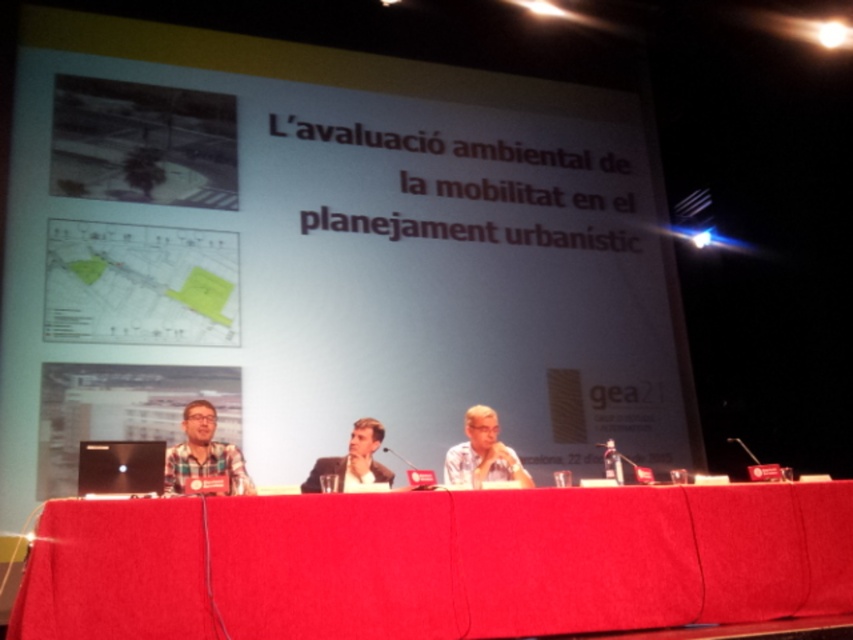
Who is more forward, (836, 570) or (502, 474)?

Point (836, 570) is in front.

Is red fabric table at center positioned at the back of matte black glasses at center?

No.

Image resolution: width=853 pixels, height=640 pixels. Describe the element at coordinates (527, 561) in the screenshot. I see `red fabric table at center` at that location.

Locate an element on the screen. red fabric table at center is located at coordinates (527, 561).

Which is behind, point (280, 72) or point (447, 468)?

Positioned behind is point (280, 72).

Does white paper at center have a greater height compared to matte black glasses at center?

Yes, white paper at center is taller than matte black glasses at center.

At what (x,y) coordinates should I click in order to perform the action: click on white paper at center. Please return your answer as a coordinate pair (x, y). Looking at the image, I should click on (326, 253).

Find the location of a particular element. This screenshot has height=640, width=853. white paper at center is located at coordinates (326, 253).

Is plaid fabric shirt at center bigger than black plastic microphone at center?

Yes, plaid fabric shirt at center is bigger than black plastic microphone at center.

What do you see at coordinates (204, 452) in the screenshot? The width and height of the screenshot is (853, 640). I see `plaid fabric shirt at center` at bounding box center [204, 452].

At what (x,y) coordinates should I click in order to perform the action: click on plaid fabric shirt at center. Please return your answer as a coordinate pair (x, y). Looking at the image, I should click on (204, 452).